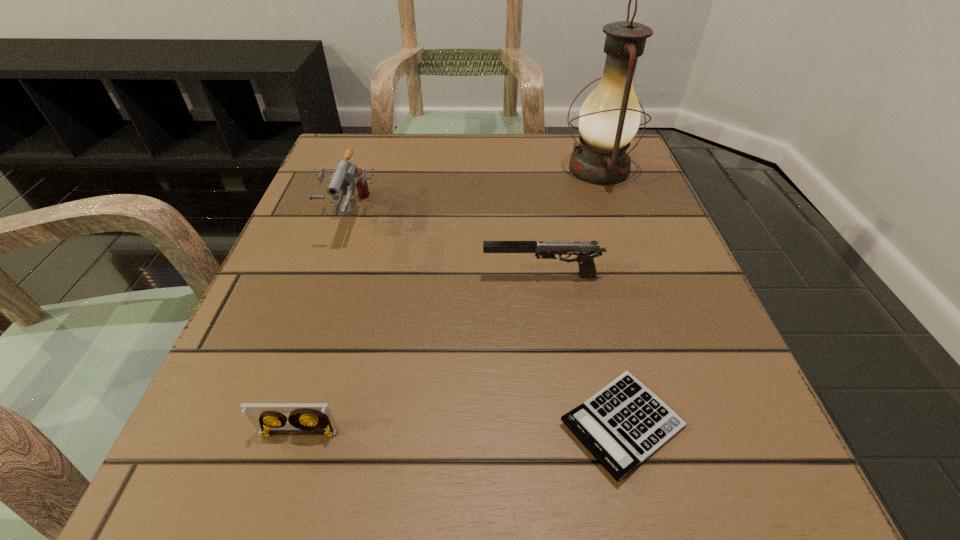
The image size is (960, 540). In order to click on the tallest object in this screenshot , I will do `click(609, 118)`.

Locate an element on the screen. the farther gun is located at coordinates (346, 174).

Locate an element on the screen. Image resolution: width=960 pixels, height=540 pixels. the taller gun is located at coordinates (346, 174).

The image size is (960, 540). Find the location of `the shorter gun`. the shorter gun is located at coordinates (586, 251).

At what (x,y) coordinates should I click in order to perform the action: click on the nearer gun. Please return your answer as a coordinate pair (x, y). The image size is (960, 540). Looking at the image, I should click on (586, 251).

Identify the location of videotape. (305, 418).

This screenshot has height=540, width=960. What are the coordinates of `the shortest object` in the screenshot? It's located at 623,424.

Identify the location of vacant space positioned on the front of the tallest object. The height and width of the screenshot is (540, 960). (620, 231).

Identify the location of vacant region located 0.110m at the barrel end of the left gun. (324, 291).

Where is `free point located 0.100m at the muzzle end of the third nearest object`? The width and height of the screenshot is (960, 540). free point located 0.100m at the muzzle end of the third nearest object is located at coordinates (423, 276).